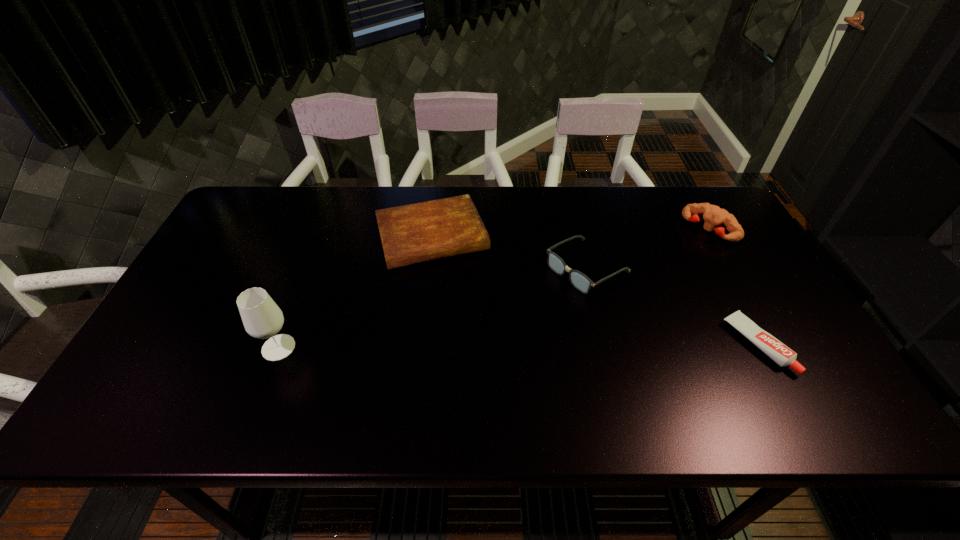
Locate an element on the screen. free spot at the far right corner of the desktop is located at coordinates (684, 224).

Locate an element on the screen. The width and height of the screenshot is (960, 540). blank space at the near right corner of the desktop is located at coordinates (789, 368).

Where is `empty location between the puncher and the shortest object`? The image size is (960, 540). empty location between the puncher and the shortest object is located at coordinates (733, 287).

This screenshot has height=540, width=960. I want to click on free area in between the second object from left to right and the tallest object, so click(x=355, y=292).

In order to click on empty location between the second shortest object and the shortest object in this screenshot , I will do `click(594, 291)`.

Locate an element on the screen. The image size is (960, 540). unoccupied area between the tallest object and the spectacles is located at coordinates (433, 307).

The width and height of the screenshot is (960, 540). Identify the location of free space between the puncher and the second shortest object. (570, 233).

In order to click on free spot between the leftmost object and the shortest object in this screenshot , I will do `click(517, 346)`.

Locate an element on the screen. The image size is (960, 540). empty location between the second shortest object and the spectacles is located at coordinates (510, 252).

Image resolution: width=960 pixels, height=540 pixels. What are the coordinates of `free space that is in between the fourth tallest object and the glass` in the screenshot? It's located at (355, 292).